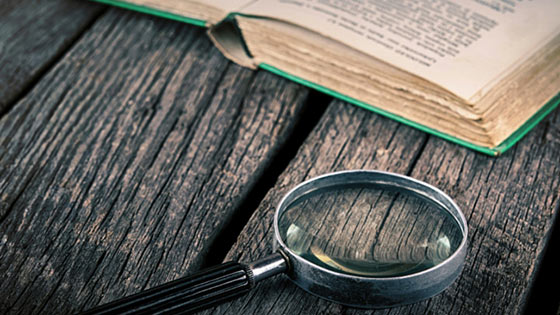
Where is `looking glass handle`? Image resolution: width=560 pixels, height=315 pixels. looking glass handle is located at coordinates click(x=222, y=285).